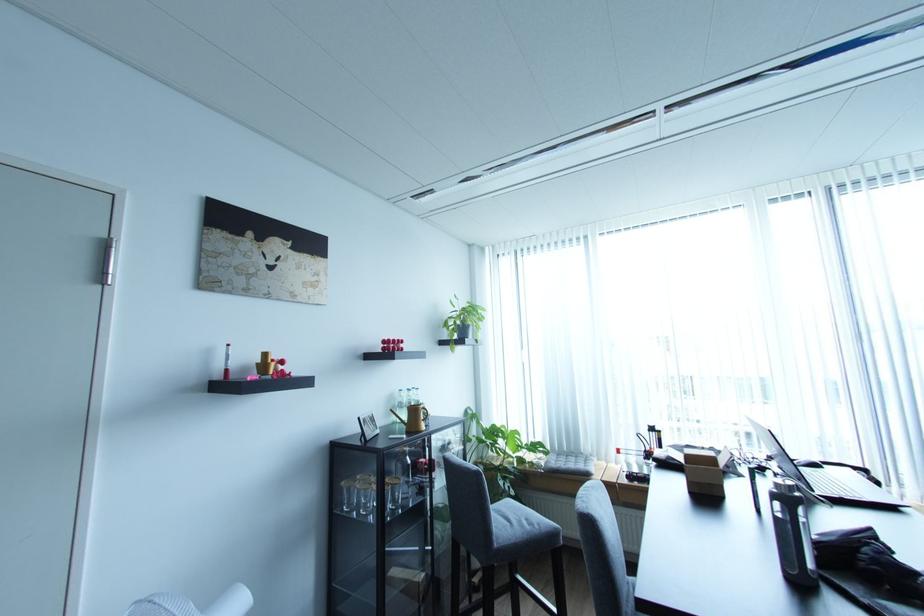
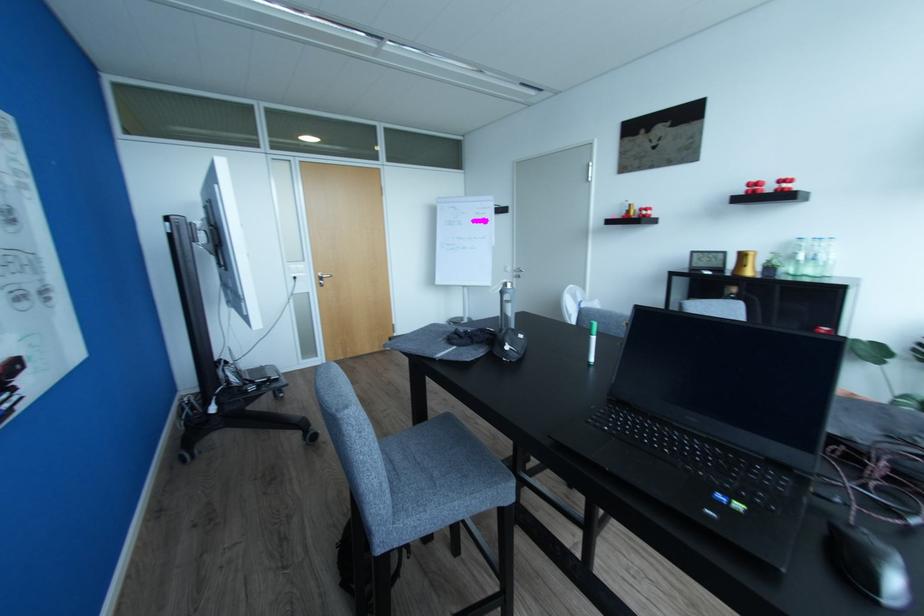
Locate, in the second image, the point that corresponds to point 395,339 in the first image.

(760, 180)